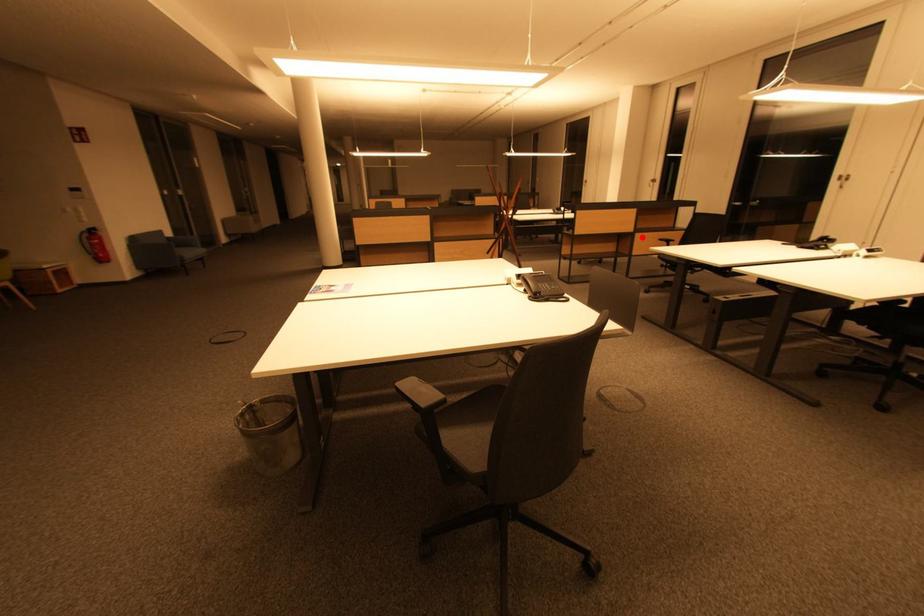
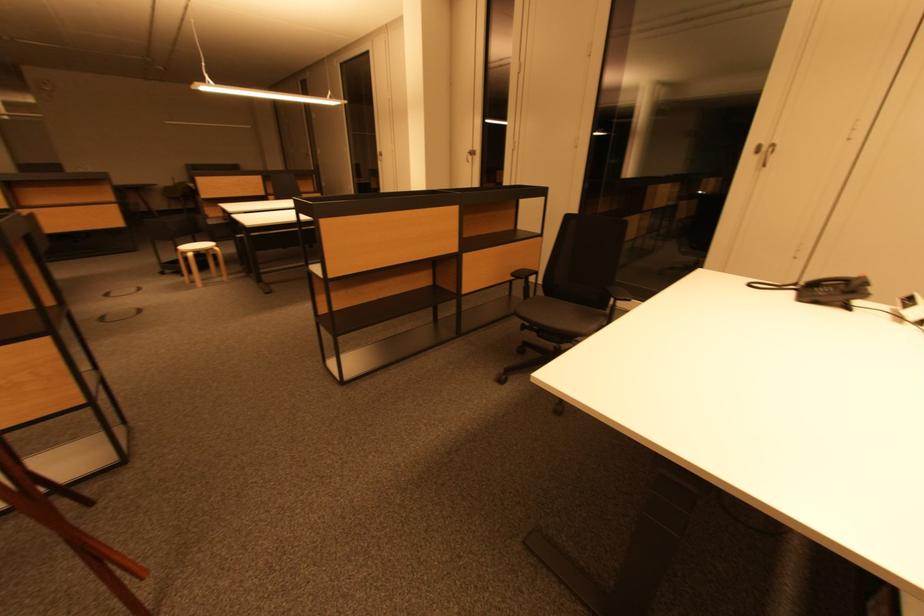
Locate, in the second image, the point that corresponds to the highlighted location in the first image.

(470, 259)